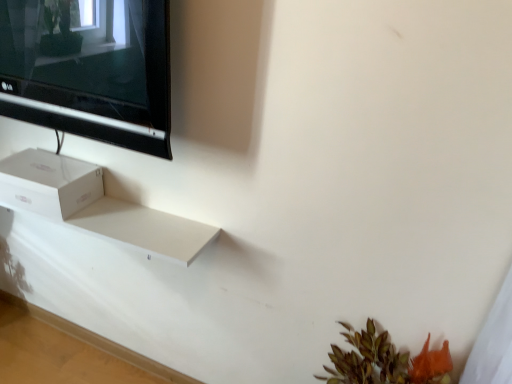
Locate an element on the screen. This screenshot has height=384, width=512. free area below white cardboard box at lower left (from a real-world perspective) is located at coordinates coord(70,356).